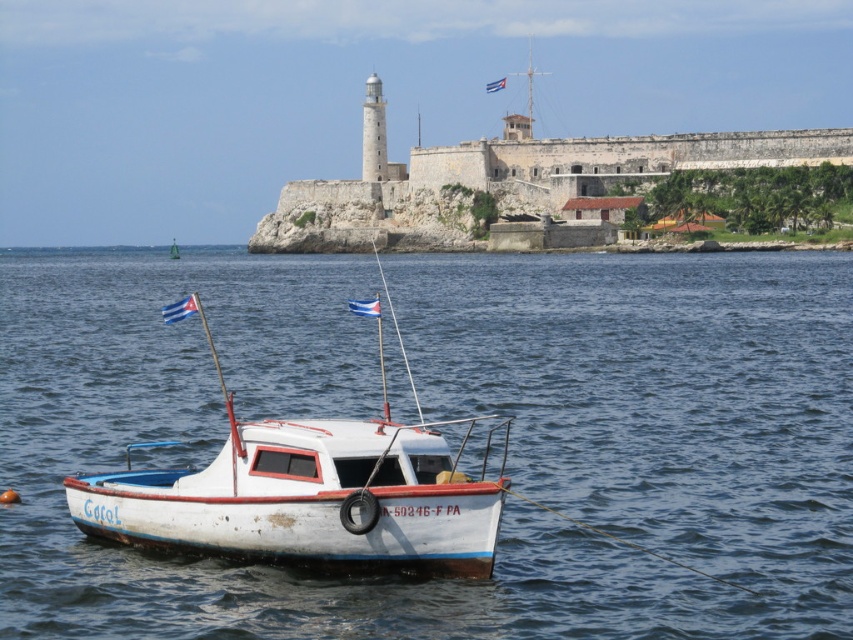
You are a sailor on the white matte boat at center. You notice the white water at boat front. In which direction relative to your boat is the white water located?

The white water at boat front is to the right of the white matte boat at center.

You are standing on the shore looking at the small fishing boat. There is a point marked at coordinates (447, 417). Based on the scene description, where is this point located?

The point marked at coordinates (447, 417) is located on the white water at the boat front.

You are standing on the deck of the fishing boat and want to locate two specific points marked in the scene. Which of the two points, point [474,348] or point [126,472], is closer to you?

Point [474,348] is closer to you because it is further to the viewer than point [126,472].